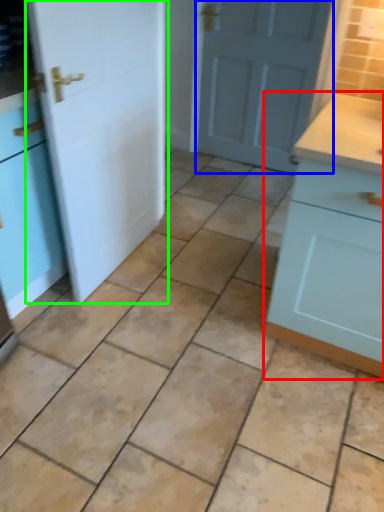
Question: Which is farther away from cabinetry (highlighted by a red box)? door (highlighted by a blue box) or door (highlighted by a green box)?

Choices:
 (A) door
 (B) door

Answer: (A)